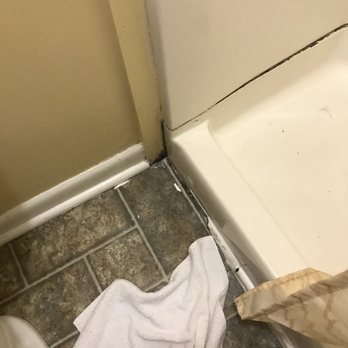
Locate an element on the screen. textured stripes in shower curtain is located at coordinates click(x=331, y=306), click(x=304, y=313), click(x=291, y=321), click(x=267, y=319).